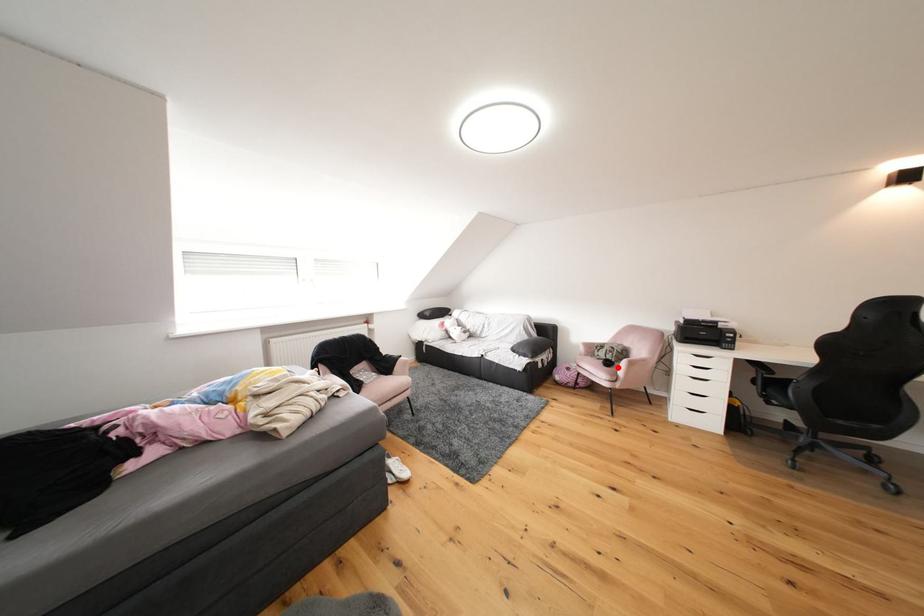
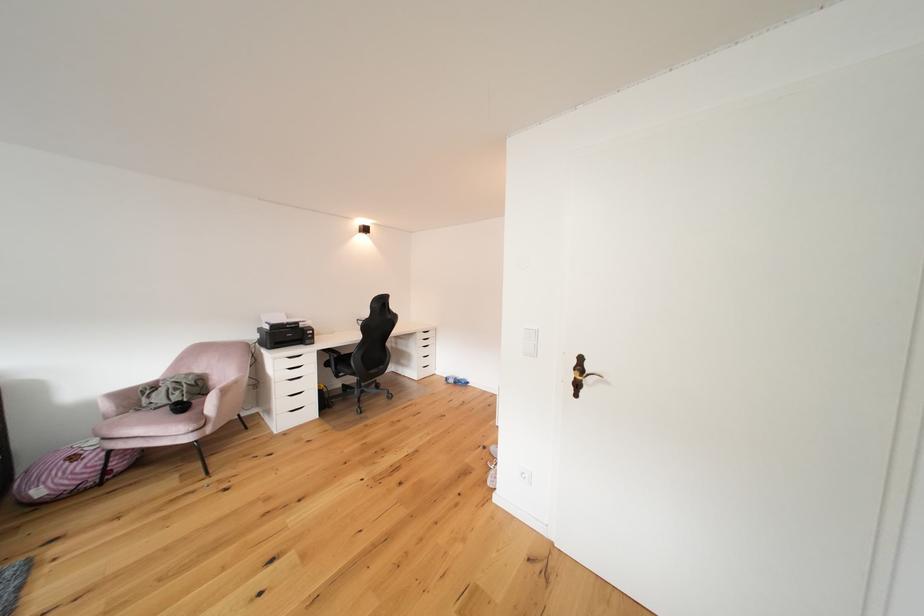
Where in the second image is the point corresponding to the highlighted location from the first image?

(190, 411)